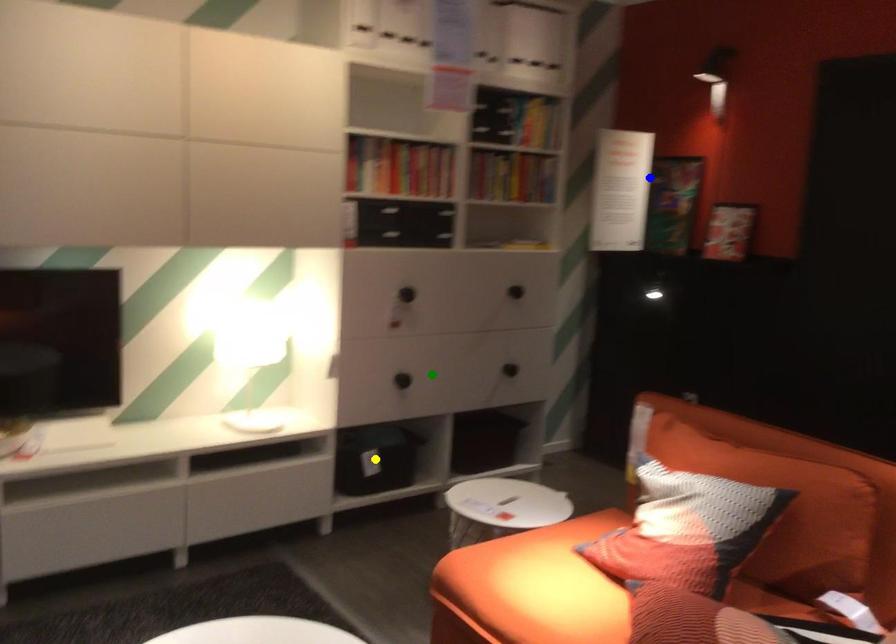
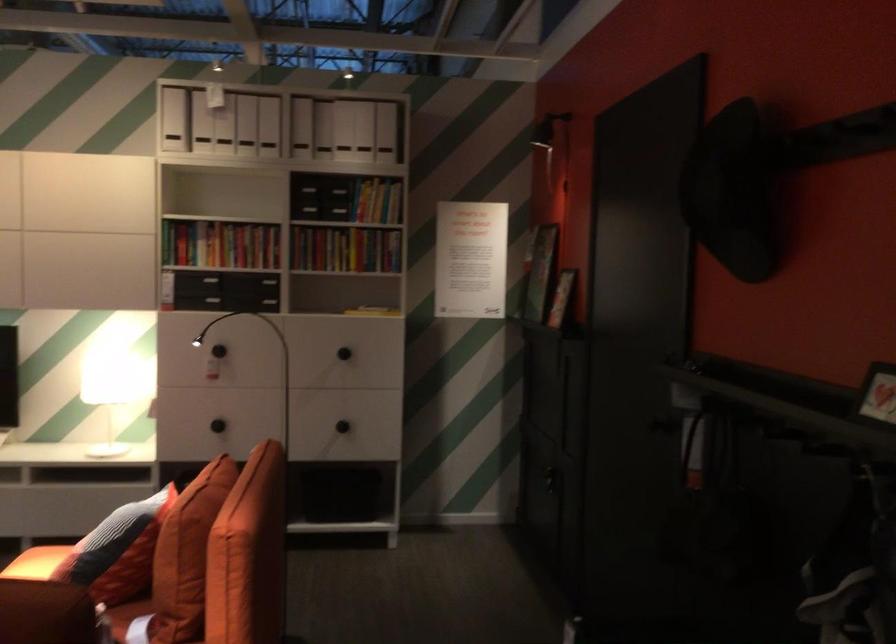
I am providing you with two images of the same scene from different viewpoints. Three points are marked in image1. Which point corresponds to a part or object that is occluded in image2?In image1, three points are marked. Which of them correspond to a part or object that is occluded in image2?Among the three points shown in image1, which one corresponds to a part or object that is no longer visible due to occlusion in image2?

Invisible in image2: yellow point.